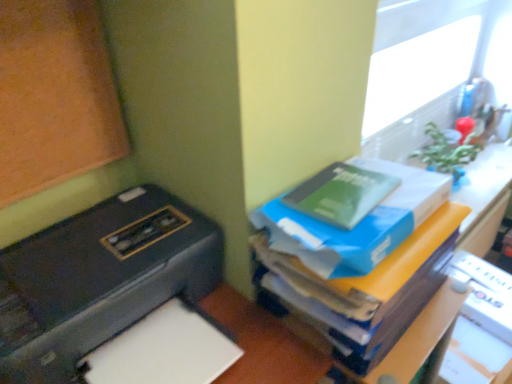
Question: Would you say white paper at lower left is outside blue cardboard box at upper right?

Choices:
 (A) yes
 (B) no

Answer: (A)

Question: Considering the relative positions of white paper at lower left and blue cardboard box at upper right in the image provided, is white paper at lower left in front of blue cardboard box at upper right?

Choices:
 (A) no
 (B) yes

Answer: (A)

Question: From the image's perspective, would you say white paper at lower left is shown under blue cardboard box at upper right?

Choices:
 (A) no
 (B) yes

Answer: (B)

Question: Is white paper at lower left taller than blue cardboard box at upper right?

Choices:
 (A) no
 (B) yes

Answer: (A)

Question: Is white paper at lower left to the right of blue cardboard box at upper right from the viewer's perspective?

Choices:
 (A) no
 (B) yes

Answer: (A)

Question: Is blue cardboard box at upper right taller or shorter than black plastic printer at left?

Choices:
 (A) tall
 (B) short

Answer: (A)

Question: Is point (478, 188) positioned closer to the camera than point (117, 297)?

Choices:
 (A) farther
 (B) closer

Answer: (A)

Question: Considering their positions, is blue cardboard box at upper right located in front of or behind black plastic printer at left?

Choices:
 (A) front
 (B) behind

Answer: (B)

Question: Is blue cardboard box at upper right situated inside black plastic printer at left or outside?

Choices:
 (A) inside
 (B) outside

Answer: (B)

Question: From the image's perspective, is green matte book at upper right, placed as the 1th paperback book when sorted from top to bottom, above or below green matte book at upper right, the first paperback book ordered from the bottom?

Choices:
 (A) above
 (B) below

Answer: (A)

Question: From their relative heights in the image, would you say green matte book at upper right, placed as the 1th paperback book when sorted from top to bottom, is taller or shorter than green matte book at upper right, the first paperback book ordered from the bottom?

Choices:
 (A) short
 (B) tall

Answer: (A)

Question: Is point (384, 183) closer or farther from the camera than point (333, 273)?

Choices:
 (A) farther
 (B) closer

Answer: (A)

Question: Is green matte book at upper right, acting as the second paperback book starting from the bottom, inside or outside of green matte book at upper right, the first paperback book ordered from the bottom?

Choices:
 (A) outside
 (B) inside

Answer: (B)

Question: Would you say black plastic printer at left is to the left or to the right of blue cardboard box at upper right in the picture?

Choices:
 (A) left
 (B) right

Answer: (A)

Question: From a real-world perspective, is black plastic printer at left above or below blue cardboard box at upper right?

Choices:
 (A) above
 (B) below

Answer: (B)